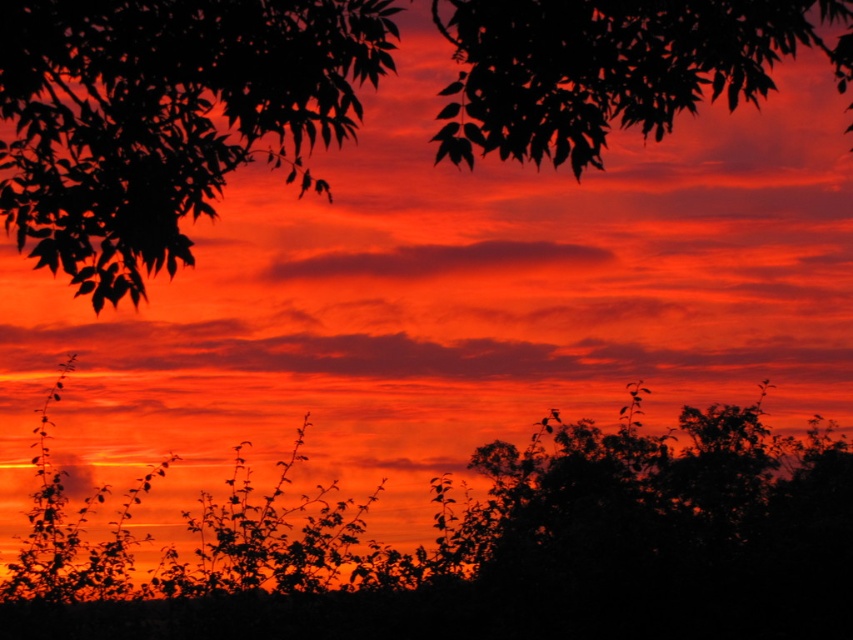
Question: Is silhouette leafy tree at upper left above matte orange cloud at center?

Choices:
 (A) yes
 (B) no

Answer: (B)

Question: Which of the following is the closest to the observer?

Choices:
 (A) (460, 49)
 (B) (329, 262)
 (C) (500, 586)

Answer: (C)

Question: Is silky leaves at upper left positioned at the back of matte orange cloud at center?

Choices:
 (A) yes
 (B) no

Answer: (B)

Question: Which point is closer to the camera?

Choices:
 (A) (90, 140)
 (B) (236, 550)

Answer: (B)

Question: Which point appears closest to the camera in this image?

Choices:
 (A) (514, 540)
 (B) (584, 112)
 (C) (335, 257)

Answer: (A)

Question: In this image, where is silhouette leafy tree at upper left located relative to matte orange cloud at center?

Choices:
 (A) above
 (B) below

Answer: (B)